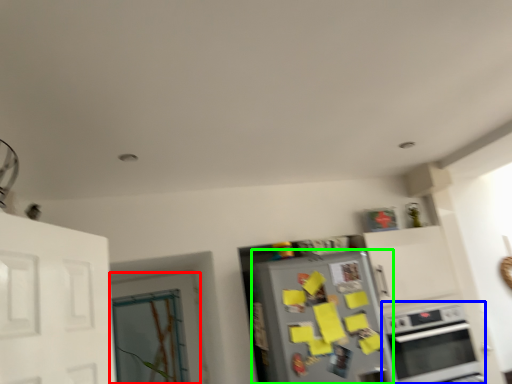
Question: Based on their relative distances, which object is farther from door (highlighted by a red box)? Choose from oven (highlighted by a blue box) and refrigerator (highlighted by a green box).

Choices:
 (A) oven
 (B) refrigerator

Answer: (A)